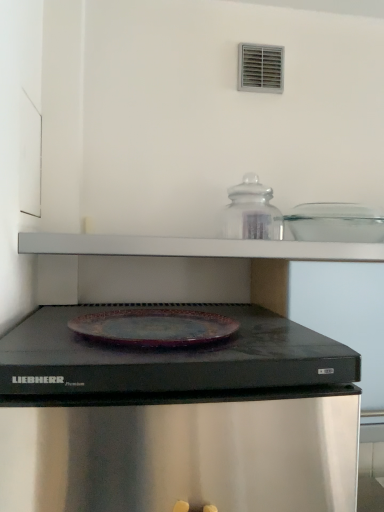
You are a GUI agent. You are given a task and a screenshot of the screen. Output one action in this format:
    pyautogui.click(x=<x>, y=<y>)
    Task: Click on the clear glass jar at upper center, which is the second appliance from left to right
    
    Given the screenshot: What is the action you would take?
    pyautogui.click(x=335, y=223)

Describe the element at coordinates (335, 223) in the screenshot. I see `clear glass jar at upper center, the 1th appliance from the right` at that location.

Locate an element on the screen. transparent glass jar at upper center, placed as the second appliance when sorted from right to left is located at coordinates (251, 212).

Describe the element at coordinates (251, 212) in the screenshot. I see `transparent glass jar at upper center, the 1th appliance positioned from the left` at that location.

The height and width of the screenshot is (512, 384). Find the location of `clear glass jar at upper center, the 1th appliance from the right`. clear glass jar at upper center, the 1th appliance from the right is located at coordinates (335, 223).

Based on the photo, which object is positioned more to the right, transparent glass jar at upper center, placed as the second appliance when sorted from right to left, or clear glass jar at upper center, which is the second appliance from left to right?

clear glass jar at upper center, which is the second appliance from left to right.

Which object is further away from the camera, transparent glass jar at upper center, the 1th appliance positioned from the left, or clear glass jar at upper center, which is the second appliance from left to right?

transparent glass jar at upper center, the 1th appliance positioned from the left, is further away from the camera.

Is point (264, 218) behind point (327, 238)?

No, it is not.

From the image's perspective, is transparent glass jar at upper center, placed as the second appliance when sorted from right to left, positioned above or below clear glass jar at upper center, which is the second appliance from left to right?

Clearly, from the image's perspective, transparent glass jar at upper center, placed as the second appliance when sorted from right to left, is above clear glass jar at upper center, which is the second appliance from left to right.

From a real-world perspective, is transparent glass jar at upper center, placed as the second appliance when sorted from right to left, positioned over clear glass jar at upper center, which is the second appliance from left to right, based on gravity?

Indeed, from a real-world perspective, transparent glass jar at upper center, placed as the second appliance when sorted from right to left, stands above clear glass jar at upper center, which is the second appliance from left to right.

Considering the sizes of objects transparent glass jar at upper center, placed as the second appliance when sorted from right to left, and clear glass jar at upper center, the 1th appliance from the right, in the image provided, who is thinner, transparent glass jar at upper center, placed as the second appliance when sorted from right to left, or clear glass jar at upper center, the 1th appliance from the right,?

With smaller width is transparent glass jar at upper center, placed as the second appliance when sorted from right to left.

In the scene shown: Which of these two, transparent glass jar at upper center, the 1th appliance positioned from the left, or clear glass jar at upper center, which is the second appliance from left to right, stands taller?

Standing taller between the two is transparent glass jar at upper center, the 1th appliance positioned from the left.

From the picture: Can you confirm if transparent glass jar at upper center, placed as the second appliance when sorted from right to left, is bigger than clear glass jar at upper center, which is the second appliance from left to right?

No, transparent glass jar at upper center, placed as the second appliance when sorted from right to left, is not bigger than clear glass jar at upper center, which is the second appliance from left to right.

Is transparent glass jar at upper center, placed as the second appliance when sorted from right to left, located outside clear glass jar at upper center, which is the second appliance from left to right?

Yes, transparent glass jar at upper center, placed as the second appliance when sorted from right to left, is not within clear glass jar at upper center, which is the second appliance from left to right.

Is transparent glass jar at upper center, the 1th appliance positioned from the left, next to clear glass jar at upper center, the 1th appliance from the right?

No, transparent glass jar at upper center, the 1th appliance positioned from the left, is not with clear glass jar at upper center, the 1th appliance from the right.

Is transparent glass jar at upper center, placed as the second appliance when sorted from right to left, oriented towards clear glass jar at upper center, the 1th appliance from the right?

No.

How different are the orientations of transparent glass jar at upper center, placed as the second appliance when sorted from right to left, and clear glass jar at upper center, which is the second appliance from left to right, in degrees?

The facing directions of transparent glass jar at upper center, placed as the second appliance when sorted from right to left, and clear glass jar at upper center, which is the second appliance from left to right, are 0.938 degrees apart.

Identify the location of appliance located above the clear glass jar at upper center, the 1th appliance from the right (from the image's perspective). This screenshot has height=512, width=384. pyautogui.click(x=251, y=212).

Is clear glass jar at upper center, which is the second appliance from left to right, to the right of transparent glass jar at upper center, placed as the second appliance when sorted from right to left, from the viewer's perspective?

Yes.

In the image, is clear glass jar at upper center, which is the second appliance from left to right, positioned in front of or behind transparent glass jar at upper center, the 1th appliance positioned from the left?

clear glass jar at upper center, which is the second appliance from left to right, is positioned closer to the viewer than transparent glass jar at upper center, the 1th appliance positioned from the left.

Considering the positions of points (356, 229) and (224, 210), is point (356, 229) farther from camera compared to point (224, 210)?

Yes, point (356, 229) is farther from viewer.

From the image's perspective, does clear glass jar at upper center, the 1th appliance from the right, appear higher than transparent glass jar at upper center, placed as the second appliance when sorted from right to left?

No, from the image's perspective, clear glass jar at upper center, the 1th appliance from the right, is not above transparent glass jar at upper center, placed as the second appliance when sorted from right to left.

From a real-world perspective, which object rests below the other?

In real-world perspective, clear glass jar at upper center, the 1th appliance from the right, is lower.

Considering the sizes of clear glass jar at upper center, which is the second appliance from left to right, and transparent glass jar at upper center, placed as the second appliance when sorted from right to left, in the image, is clear glass jar at upper center, which is the second appliance from left to right, wider or thinner than transparent glass jar at upper center, placed as the second appliance when sorted from right to left,?

clear glass jar at upper center, which is the second appliance from left to right, is wider than transparent glass jar at upper center, placed as the second appliance when sorted from right to left.

Considering the relative sizes of clear glass jar at upper center, the 1th appliance from the right, and transparent glass jar at upper center, the 1th appliance positioned from the left, in the image provided, is clear glass jar at upper center, the 1th appliance from the right, shorter than transparent glass jar at upper center, the 1th appliance positioned from the left,?

Yes.

In terms of size, does clear glass jar at upper center, the 1th appliance from the right, appear bigger or smaller than transparent glass jar at upper center, the 1th appliance positioned from the left?

Considering their sizes, clear glass jar at upper center, the 1th appliance from the right, takes up more space than transparent glass jar at upper center, the 1th appliance positioned from the left.

Choose the correct answer: Is clear glass jar at upper center, which is the second appliance from left to right, inside transparent glass jar at upper center, placed as the second appliance when sorted from right to left, or outside it?

clear glass jar at upper center, which is the second appliance from left to right, lies outside transparent glass jar at upper center, placed as the second appliance when sorted from right to left.

Does clear glass jar at upper center, which is the second appliance from left to right, touch transparent glass jar at upper center, placed as the second appliance when sorted from right to left?

clear glass jar at upper center, which is the second appliance from left to right, and transparent glass jar at upper center, placed as the second appliance when sorted from right to left, are not in contact.

Is clear glass jar at upper center, the 1th appliance from the right, positioned with its back to transparent glass jar at upper center, the 1th appliance positioned from the left?

clear glass jar at upper center, the 1th appliance from the right, does not have its back to transparent glass jar at upper center, the 1th appliance positioned from the left.

Consider the image. How different are the orientations of clear glass jar at upper center, which is the second appliance from left to right, and transparent glass jar at upper center, placed as the second appliance when sorted from right to left, in degrees?

There is a 0.938-degree angle between the facing directions of clear glass jar at upper center, which is the second appliance from left to right, and transparent glass jar at upper center, placed as the second appliance when sorted from right to left.

Find the location of `appliance that appears behind the clear glass jar at upper center, which is the second appliance from left to right`. appliance that appears behind the clear glass jar at upper center, which is the second appliance from left to right is located at coordinates (251, 212).

Find the location of a particular element. The height and width of the screenshot is (512, 384). appliance lying on the right of transparent glass jar at upper center, placed as the second appliance when sorted from right to left is located at coordinates (335, 223).

This screenshot has height=512, width=384. In order to click on appliance that is behind the clear glass jar at upper center, which is the second appliance from left to right in this screenshot , I will do `click(251, 212)`.